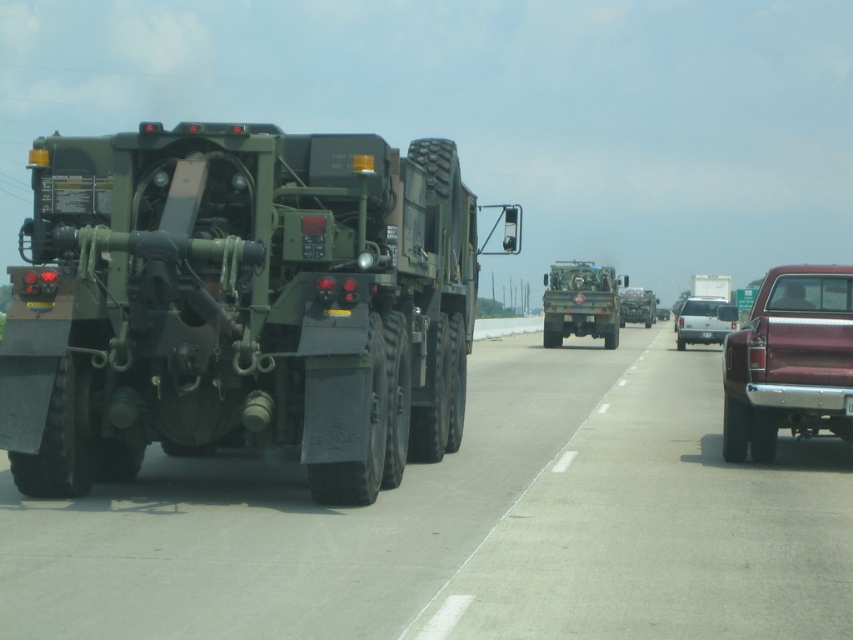
Can you confirm if matte green truck at center is thinner than metallic silver trailer at center?

No, matte green truck at center is not thinner than metallic silver trailer at center.

This screenshot has width=853, height=640. Describe the element at coordinates (579, 301) in the screenshot. I see `matte green truck at center` at that location.

Locate an element on the screen. This screenshot has width=853, height=640. matte green truck at center is located at coordinates (579, 301).

Is matte green military vehicle at left positioned behind maroon metallic truck at right?

That is False.

Describe the element at coordinates (241, 305) in the screenshot. The height and width of the screenshot is (640, 853). I see `matte green military vehicle at left` at that location.

This screenshot has width=853, height=640. Identify the location of matte green military vehicle at left. (241, 305).

Is maroon metallic truck at right positioned behind matte green truck at center?

That is False.

In the scene shown: Who is shorter, maroon metallic truck at right or matte green truck at center?

maroon metallic truck at right

Identify the location of maroon metallic truck at right. This screenshot has height=640, width=853. (788, 362).